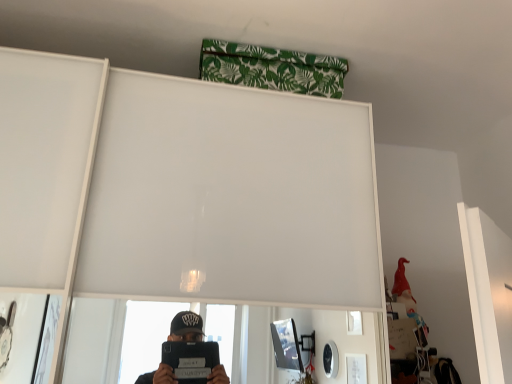
In order to face green leaf-patterned fabric at upper center, should I rotate leftwards or rightwards?

Rotate your view right by about 2.009°.

Locate an element on the screen. This screenshot has width=512, height=384. green leaf-patterned fabric at upper center is located at coordinates (272, 68).

What do you see at coordinates (272, 68) in the screenshot? I see `green leaf-patterned fabric at upper center` at bounding box center [272, 68].

Find the location of a particular element. This screenshot has height=384, width=512. green leaf-patterned fabric at upper center is located at coordinates (272, 68).